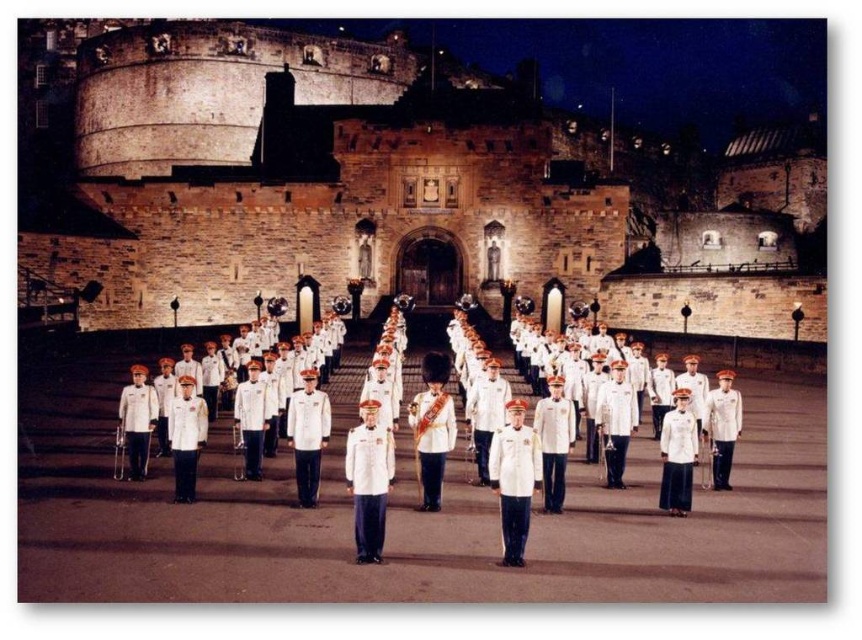
You are a photographer positioned in front of Edinburgh Castle at night. You want to capture a photo of the white uniformed band at center and the matte white uniform at center. Based on their positions, which one appears closer to your camera?

The matte white uniform at center appears closer to the camera because the white uniformed band at center is positioned behind it.

You are a photographer standing in front of Edinburgh Castle at night. You want to capture a photo of the matte white uniform at center and the white uniformed band at center. Based on their positions, which one should you focus on first to ensure both are in the frame?

The matte white uniform at center is located above the white uniformed band at center, so you should focus on the white uniformed band at center first to ensure both are in the frame.